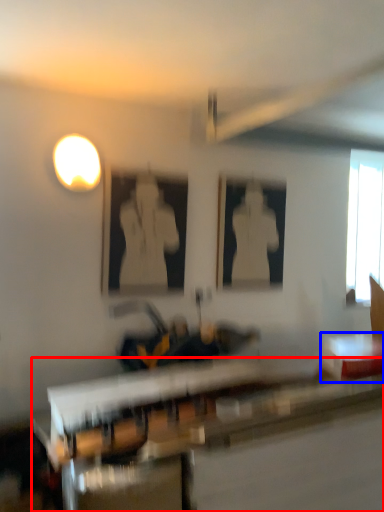
Question: Among these objects, which one is nearest to the camera, table (highlighted by a red box) or table (highlighted by a blue box)?

Choices:
 (A) table
 (B) table

Answer: (A)